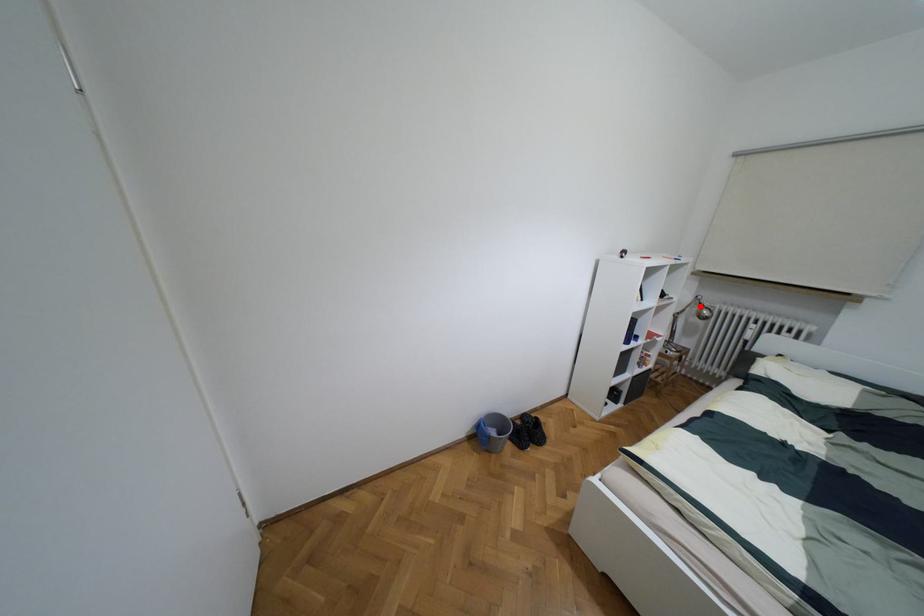
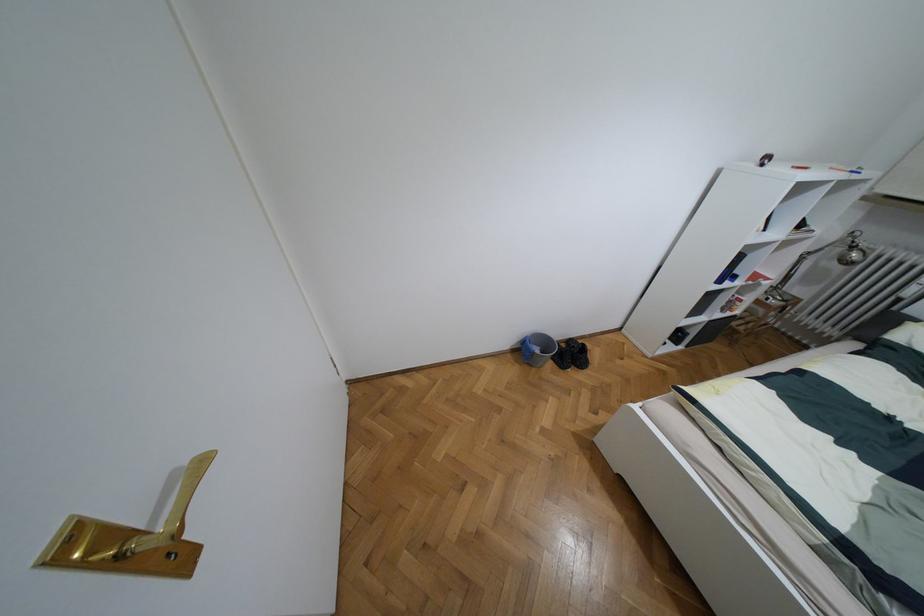
Find the pixel in the second image that matches the highlighted location in the first image.

(852, 246)